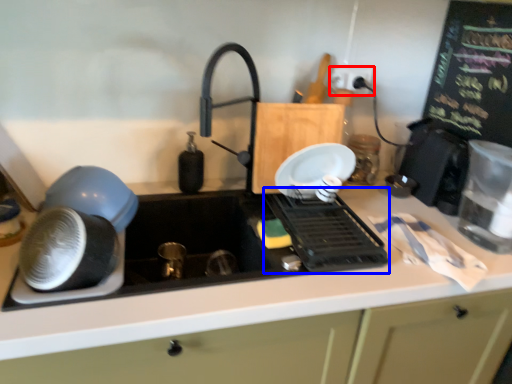
Question: Which object is further to the camera taking this photo, electric outlet (highlighted by a red box) or appliance (highlighted by a blue box)?

Choices:
 (A) electric outlet
 (B) appliance

Answer: (A)